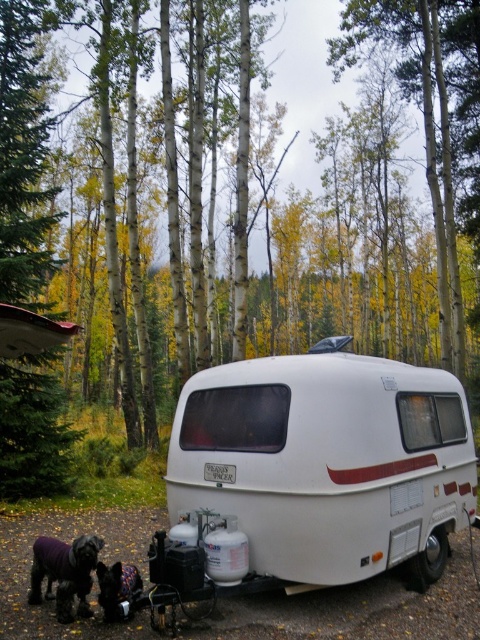
Is point (410, 372) positioned behind point (87, 534)?

No, it is in front of (87, 534).

Is white matte trailer at center taller than dark brown fur at lower left?

Yes, white matte trailer at center is taller than dark brown fur at lower left.

This screenshot has height=640, width=480. I want to click on white matte trailer at center, so click(x=322, y=468).

Between point (52, 561) and point (112, 580), which one is positioned in front?

Positioned in front is point (112, 580).

Between dark brown fur at lower left and black fur dog at lower left, which one has more height?

dark brown fur at lower left

The width and height of the screenshot is (480, 640). What do you see at coordinates (64, 572) in the screenshot? I see `dark brown fur at lower left` at bounding box center [64, 572].

Identify the location of dark brown fur at lower left. This screenshot has width=480, height=640. (64, 572).

Does white matte trailer at center have a smaller size compared to black fur dog at lower left?

Incorrect, white matte trailer at center is not smaller in size than black fur dog at lower left.

Between point (204, 476) and point (124, 592), which one is positioned in front?

Point (124, 592)

Does point (199, 428) lie in front of point (137, 577)?

No, (199, 428) is further to viewer.

Locate an element on the screen. white matte trailer at center is located at coordinates (322, 468).